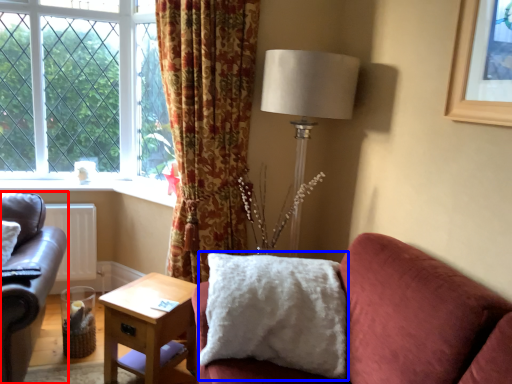
Question: Among these objects, which one is nearest to the camera, studio couch (highlighted by a red box) or pillow (highlighted by a blue box)?

Choices:
 (A) studio couch
 (B) pillow

Answer: (A)